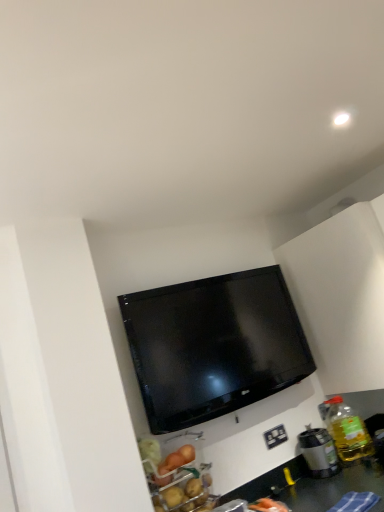
Measure the distance between point (264,438) and camera.

Point (264,438) and camera are 2.17 meters apart.

This screenshot has height=512, width=384. What are the coordinates of `metallic silver coffee maker at lower right` in the screenshot? It's located at (318, 452).

In the scene shown: Which object is more forward, metallic silver coffee maker at lower right or translucent yellow bottle at right?

metallic silver coffee maker at lower right.

Would you say metallic silver coffee maker at lower right is a long distance from translucent yellow bottle at right?

No.

From the image's perspective, is metallic silver coffee maker at lower right on top of translucent yellow bottle at right?

Actually, metallic silver coffee maker at lower right appears below translucent yellow bottle at right in the image.

In the scene shown: Between metallic silver coffee maker at lower right and translucent yellow bottle at right, which one appears on the right side from the viewer's perspective?

translucent yellow bottle at right.

Is white plastic electrical outlet at lower right not close to metallic silver coffee maker at lower right?

No.

From a real-world perspective, between white plastic electrical outlet at lower right and metallic silver coffee maker at lower right, who is vertically higher?

white plastic electrical outlet at lower right.

Between white plastic electrical outlet at lower right and metallic silver coffee maker at lower right, which one has larger size?

Bigger between the two is metallic silver coffee maker at lower right.

In the scene shown: Could metallic silver coffee maker at lower right be considered to be inside white plastic electrical outlet at lower right?

No.

Is translucent yellow bottle at right wider than metallic silver coffee maker at lower right?

Yes, translucent yellow bottle at right is wider than metallic silver coffee maker at lower right.

Is translucent yellow bottle at right oriented away from metallic silver coffee maker at lower right?

That's not correct — translucent yellow bottle at right is not looking away from metallic silver coffee maker at lower right.

Looking at this image, does translucent yellow bottle at right appear on the right side of metallic silver coffee maker at lower right?

Correct, you'll find translucent yellow bottle at right to the right of metallic silver coffee maker at lower right.

Find the location of a particular element. The height and width of the screenshot is (512, 384). appliance lying below the white plastic electrical outlet at lower right (from the image's perspective) is located at coordinates (318, 452).

Looking at the image, does metallic silver coffee maker at lower right seem bigger or smaller compared to white plastic electrical outlet at lower right?

In the image, metallic silver coffee maker at lower right appears to be larger than white plastic electrical outlet at lower right.

From a real-world perspective, which is physically below, metallic silver coffee maker at lower right or white plastic electrical outlet at lower right?

From a 3D spatial view, metallic silver coffee maker at lower right is below.

Considering the positions of objects metallic silver coffee maker at lower right and white plastic electrical outlet at lower right in the image provided, who is more to the right, metallic silver coffee maker at lower right or white plastic electrical outlet at lower right?

From the viewer's perspective, metallic silver coffee maker at lower right appears more on the right side.

Considering the relative sizes of translucent yellow bottle at right and white plastic electrical outlet at lower right in the image provided, is translucent yellow bottle at right shorter than white plastic electrical outlet at lower right?

No, translucent yellow bottle at right is not shorter than white plastic electrical outlet at lower right.

Does translucent yellow bottle at right have a smaller size compared to white plastic electrical outlet at lower right?

No, translucent yellow bottle at right is not smaller than white plastic electrical outlet at lower right.

Can white plastic electrical outlet at lower right be found inside translucent yellow bottle at right?

No, white plastic electrical outlet at lower right is not a part of translucent yellow bottle at right.

In the image, is translucent yellow bottle at right on the left side or the right side of white plastic electrical outlet at lower right?

From the image, it's evident that translucent yellow bottle at right is to the right of white plastic electrical outlet at lower right.

From the picture: Considering the sizes of objects white plastic electrical outlet at lower right and translucent yellow bottle at right in the image provided, who is shorter, white plastic electrical outlet at lower right or translucent yellow bottle at right?

With less height is white plastic electrical outlet at lower right.

Looking at this image, which object is closer to the camera taking this photo, white plastic electrical outlet at lower right or translucent yellow bottle at right?

translucent yellow bottle at right is closer to the camera.

Would you say white plastic electrical outlet at lower right is to the left or to the right of translucent yellow bottle at right in the picture?

Clearly, white plastic electrical outlet at lower right is on the left of translucent yellow bottle at right in the image.

Which object is wider, white plastic electrical outlet at lower right or translucent yellow bottle at right?

Wider between the two is translucent yellow bottle at right.

Identify the location of appliance on the left of translucent yellow bottle at right. (318, 452).

This screenshot has height=512, width=384. Identify the location of electric outlet lying above the metallic silver coffee maker at lower right (from the image's perspective). (275, 436).

Estimate the real-world distances between objects in this image. Which object is further from metallic silver coffee maker at lower right, translucent yellow bottle at right or white plastic electrical outlet at lower right?

white plastic electrical outlet at lower right is positioned further to the anchor metallic silver coffee maker at lower right.

Estimate the real-world distances between objects in this image. Which object is closer to translucent yellow bottle at right, white plastic electrical outlet at lower right or metallic silver coffee maker at lower right?

Based on the image, metallic silver coffee maker at lower right appears to be nearer to translucent yellow bottle at right.

Based on their spatial positions, is translucent yellow bottle at right or metallic silver coffee maker at lower right further from white plastic electrical outlet at lower right?

translucent yellow bottle at right is positioned further to the anchor white plastic electrical outlet at lower right.

From the image, which object appears to be farther from translucent yellow bottle at right, metallic silver coffee maker at lower right or white plastic electrical outlet at lower right?

Based on the image, white plastic electrical outlet at lower right appears to be further to translucent yellow bottle at right.

Estimate the real-world distances between objects in this image. Which object is further from metallic silver coffee maker at lower right, white plastic electrical outlet at lower right or translucent yellow bottle at right?

Among the two, white plastic electrical outlet at lower right is located further to metallic silver coffee maker at lower right.

From the picture: Based on their spatial positions, is metallic silver coffee maker at lower right or translucent yellow bottle at right further from white plastic electrical outlet at lower right?

translucent yellow bottle at right.

Identify the location of appliance between white plastic electrical outlet at lower right and translucent yellow bottle at right. This screenshot has height=512, width=384. tap(318, 452).